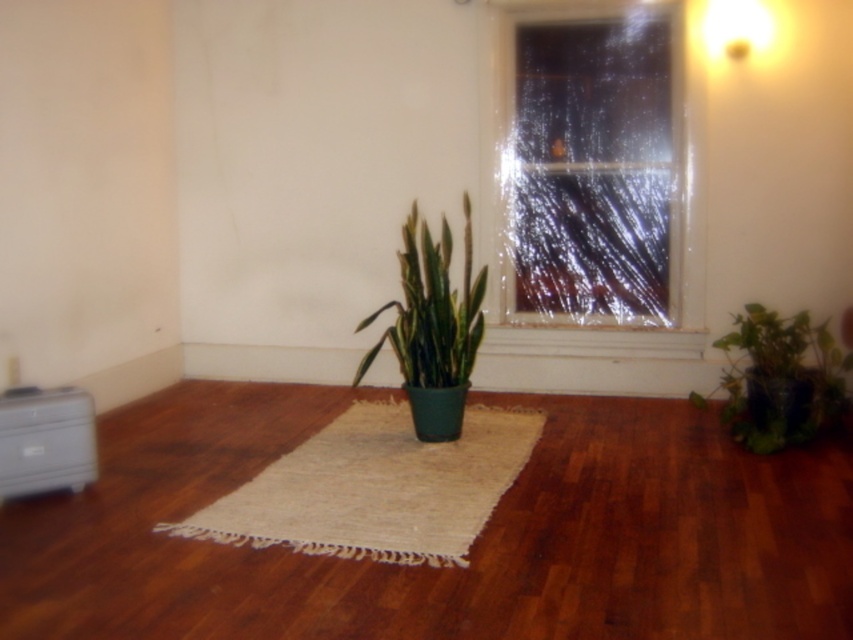
Who is positioned more to the left, transparent plastic window at upper center or green matte plant at center?

Positioned to the left is green matte plant at center.

Consider the image. Can you confirm if transparent plastic window at upper center is positioned above green matte plant at center?

Yes.

What do you see at coordinates (595, 164) in the screenshot? The height and width of the screenshot is (640, 853). I see `transparent plastic window at upper center` at bounding box center [595, 164].

I want to click on transparent plastic window at upper center, so click(595, 164).

Between point (399, 253) and point (827, 346), which one is positioned in front?

Point (827, 346) is more forward.

Between green matte plant at center and green matte plant at lower right, which one appears on the left side from the viewer's perspective?

green matte plant at center is more to the left.

What do you see at coordinates (432, 328) in the screenshot? The image size is (853, 640). I see `green matte plant at center` at bounding box center [432, 328].

This screenshot has width=853, height=640. Identify the location of green matte plant at center. (432, 328).

Who is positioned more to the left, white plastic drawer at lower left or matte white lampshade at upper right?

white plastic drawer at lower left

Between point (22, 448) and point (767, 13), which one is positioned behind?

The point (767, 13) is behind.

Find the location of a particular element. The width and height of the screenshot is (853, 640). white plastic drawer at lower left is located at coordinates (45, 448).